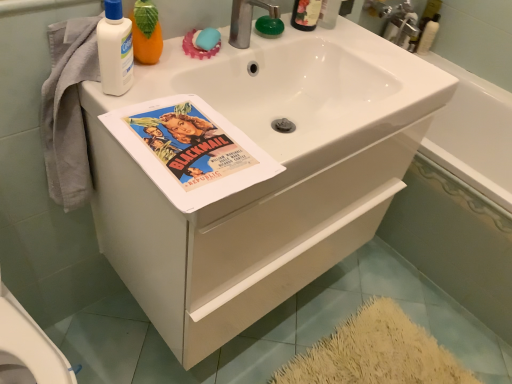
Question: Does silver metallic faucet at upper center turn towards white matte lotion at upper left, positioned as the 1th cleaning product in left-to-right order?

Choices:
 (A) no
 (B) yes

Answer: (A)

Question: Considering the relative sizes of silver metallic faucet at upper center and white matte lotion at upper left, positioned as the 1th cleaning product in left-to-right order, in the image provided, is silver metallic faucet at upper center thinner than white matte lotion at upper left, positioned as the 1th cleaning product in left-to-right order,?

Choices:
 (A) yes
 (B) no

Answer: (B)

Question: Would you say silver metallic faucet at upper center contains white matte lotion at upper left, positioned as the 2th cleaning product in right-to-left order?

Choices:
 (A) yes
 (B) no

Answer: (B)

Question: Is silver metallic faucet at upper center facing away from white matte lotion at upper left, positioned as the 1th cleaning product in bottom-to-top order?

Choices:
 (A) no
 (B) yes

Answer: (A)

Question: Does silver metallic faucet at upper center have a lesser height compared to white matte lotion at upper left, positioned as the 1th cleaning product in bottom-to-top order?

Choices:
 (A) yes
 (B) no

Answer: (A)

Question: Relative to translucent plastic bottle at upper right, acting as the 2th cleaning product starting from the bottom, is white matte lotion at upper left, positioned as the 1th cleaning product in bottom-to-top order, in front or behind?

Choices:
 (A) behind
 (B) front

Answer: (B)

Question: From the image's perspective, is white matte lotion at upper left, positioned as the 1th cleaning product in left-to-right order, positioned above or below translucent plastic bottle at upper right, the 1th cleaning product positioned from the right?

Choices:
 (A) below
 (B) above

Answer: (A)

Question: Is point (109, 89) closer or farther from the camera than point (421, 31)?

Choices:
 (A) farther
 (B) closer

Answer: (B)

Question: Would you say white matte lotion at upper left, which ranks as the 2th cleaning product in top-to-bottom order, is to the left or to the right of translucent plastic bottle at upper right, the 1th cleaning product positioned from the right, in the picture?

Choices:
 (A) left
 (B) right

Answer: (A)

Question: Looking at their shapes, would you say translucent plastic bottle at upper right, the 2th cleaning product in the front-to-back sequence, is wider or thinner than blue rubber soap at upper center?

Choices:
 (A) wide
 (B) thin

Answer: (A)

Question: Is translucent plastic bottle at upper right, which ranks as the second cleaning product in left-to-right order, inside the boundaries of blue rubber soap at upper center, or outside?

Choices:
 (A) outside
 (B) inside

Answer: (A)

Question: Relative to blue rubber soap at upper center, is translucent plastic bottle at upper right, which ranks as the second cleaning product in left-to-right order, in front or behind?

Choices:
 (A) front
 (B) behind

Answer: (B)

Question: Based on their sizes in the image, would you say translucent plastic bottle at upper right, which ranks as the second cleaning product in left-to-right order, is bigger or smaller than blue rubber soap at upper center?

Choices:
 (A) big
 (B) small

Answer: (A)

Question: Considering the positions of point (211, 29) and point (485, 112), is point (211, 29) closer or farther from the camera than point (485, 112)?

Choices:
 (A) closer
 (B) farther

Answer: (A)

Question: In the image, is blue rubber soap at upper center positioned in front of or behind white glossy bathtub at upper right, which is the first bath from left to right?

Choices:
 (A) front
 (B) behind

Answer: (A)